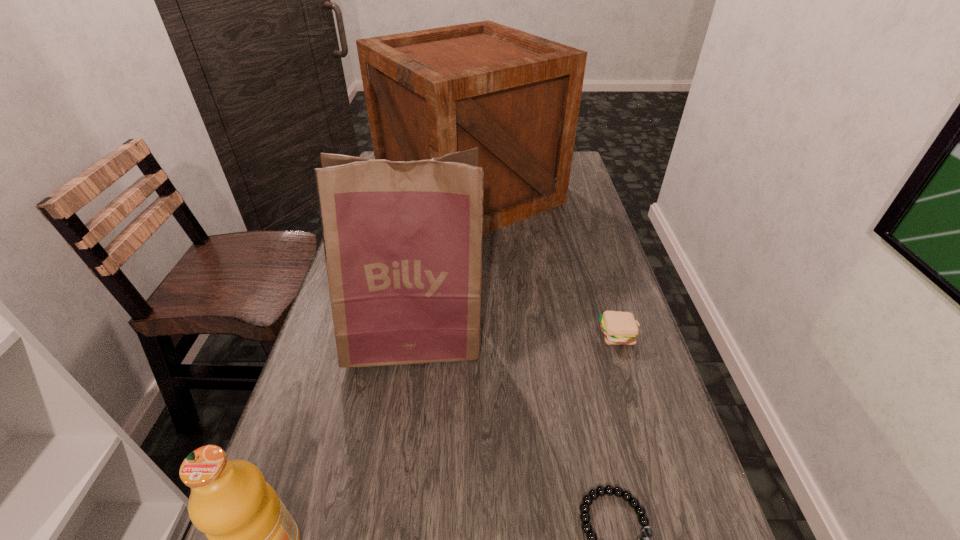
Where is `patty located in the right edge section of the desktop`? patty located in the right edge section of the desktop is located at coordinates (619, 328).

Locate an element on the screen. This screenshot has height=540, width=960. object located in the far left corner section of the desktop is located at coordinates (516, 96).

Find the location of a particular element. The width and height of the screenshot is (960, 540). object that is at the far right corner is located at coordinates (516, 96).

Where is `free region at the left edge of the desktop`? The width and height of the screenshot is (960, 540). free region at the left edge of the desktop is located at coordinates (355, 438).

Image resolution: width=960 pixels, height=540 pixels. In the image, there is a desktop. Identify the location of vacant space at the right edge. (587, 211).

Locate an element on the screen. This screenshot has height=540, width=960. the third closest object relative to the farthest object is located at coordinates (609, 490).

Identify the location of the second closest object to the fruit juice. (609, 490).